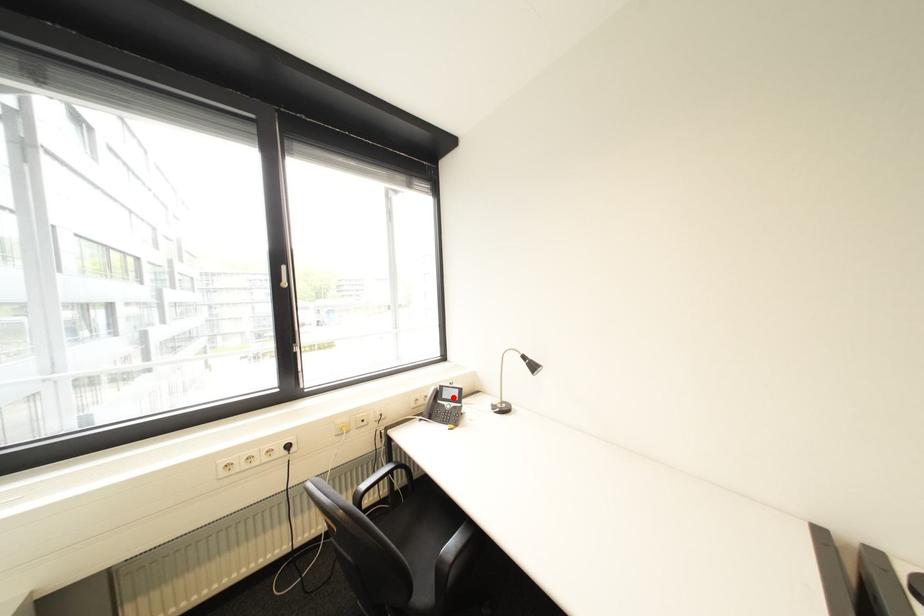
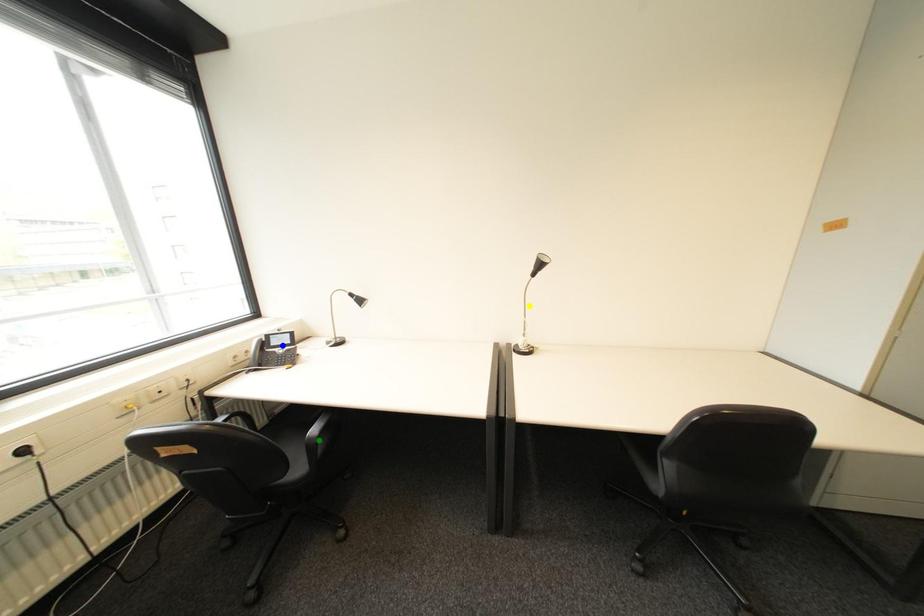
Question: I am providing you with two images of the same scene from different viewpoints. A red point is marked on the first image. You are given multiple points on the second image. Which point in image 2 is actually the same real-world point as the red point in image 1?

Choices:
 (A) blue point
 (B) yellow point
 (C) green point

Answer: (A)